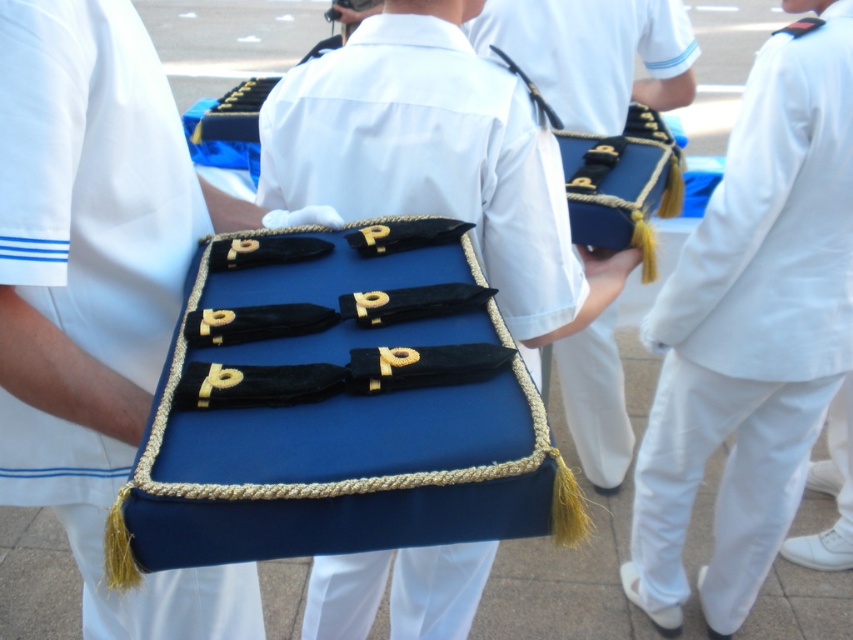
Does blue velvet pouch at center appear under blue fabric case at center?

Indeed, blue velvet pouch at center is positioned under blue fabric case at center.

Does point (395, 595) lie in front of point (671, 3)?

That is True.

Measure the distance between blue velvet pouch at center and camera.

1.06 meters

Where is `blue velvet pouch at center`? Image resolution: width=853 pixels, height=640 pixels. blue velvet pouch at center is located at coordinates (428, 150).

Find the location of a particular element. The width and height of the screenshot is (853, 640). blue velvet case at center is located at coordinates (97, 292).

Does blue velvet case at center appear on the right side of blue velvet pouch at center?

In fact, blue velvet case at center is to the left of blue velvet pouch at center.

Which is in front, point (18, 371) or point (548, 324)?

Point (18, 371) is more forward.

In order to click on blue velvet case at center in this screenshot , I will do `click(97, 292)`.

Does point (756, 129) come closer to viewer compared to point (618, 4)?

Yes, point (756, 129) is closer to viewer.

Consider the image. Does white cotton pants at right appear under blue fabric case at center?

Correct, white cotton pants at right is located below blue fabric case at center.

At what (x,y) coordinates should I click in order to perform the action: click on white cotton pants at right. Please return your answer as a coordinate pair (x, y). Looking at the image, I should click on (751, 328).